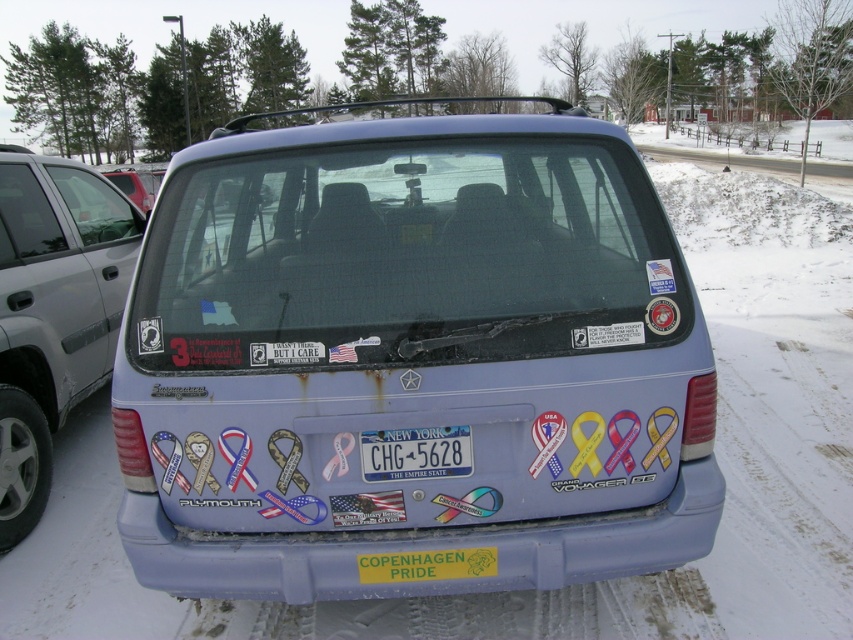
Question: Observing the image, what is the correct spatial positioning of matte blue van at center in reference to blue plastic license plate at center?

Choices:
 (A) below
 (B) above

Answer: (B)

Question: Does matte blue minivan at center appear under blue plastic license plate at center?

Choices:
 (A) no
 (B) yes

Answer: (A)

Question: Considering the relative positions of matte blue van at center and matte black van at center in the image provided, where is matte blue van at center located with respect to matte black van at center?

Choices:
 (A) above
 (B) below

Answer: (B)

Question: Which object is farther from the camera taking this photo?

Choices:
 (A) matte blue van at center
 (B) matte blue minivan at center
 (C) blue plastic license plate at center
 (D) matte black van at center

Answer: (D)

Question: Which point appears closest to the camera in this image?

Choices:
 (A) (438, 545)
 (B) (32, 209)
 (C) (141, 188)
 (D) (432, 467)

Answer: (D)

Question: Among these objects, which one is farthest from the camera?

Choices:
 (A) blue plastic license plate at center
 (B) matte blue van at center
 (C) matte black van at center

Answer: (C)